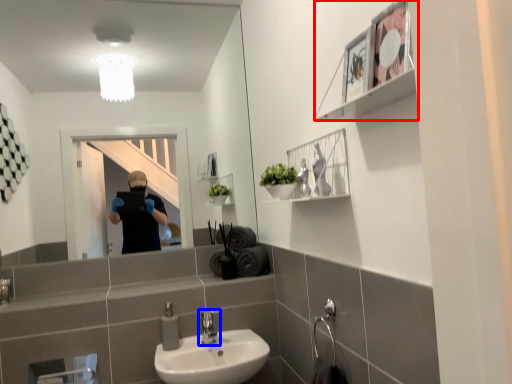
Question: Which point is further to the camera, cabinet (highlighted by a red box) or tap (highlighted by a blue box)?

Choices:
 (A) cabinet
 (B) tap

Answer: (B)